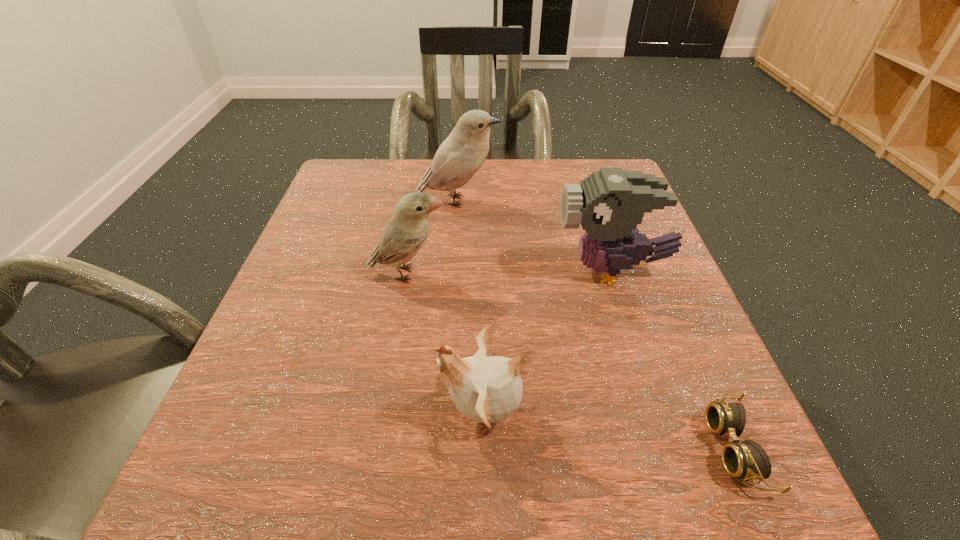
Find the location of a particular element. goggles present at the right edge is located at coordinates coord(747,460).

Locate an element on the screen. object positioned at the near right corner is located at coordinates (747, 460).

Find the location of a particular element. Image resolution: width=960 pixels, height=540 pixels. vacant space at the far edge is located at coordinates (529, 213).

Image resolution: width=960 pixels, height=540 pixels. In the image, there is a desktop. Find the location of `vacant space at the near edge`. vacant space at the near edge is located at coordinates 579,527.

In the image, there is a desktop. What are the coordinates of `vacant space at the left edge` in the screenshot? It's located at (320, 256).

In the image, there is a desktop. Identify the location of vacant space at the right edge. The height and width of the screenshot is (540, 960). (655, 429).

Identify the location of free spot at the far left corner of the desktop. Image resolution: width=960 pixels, height=540 pixels. (389, 195).

Locate an element on the screen. The image size is (960, 540). free area in between the rightmost bird and the farthest object is located at coordinates (535, 236).

Where is `vacant point located between the shortest object and the nearest bird`? vacant point located between the shortest object and the nearest bird is located at coordinates pos(609,430).

Find the location of `empty space between the rightmost bird and the shortest bird`. empty space between the rightmost bird and the shortest bird is located at coordinates (547, 341).